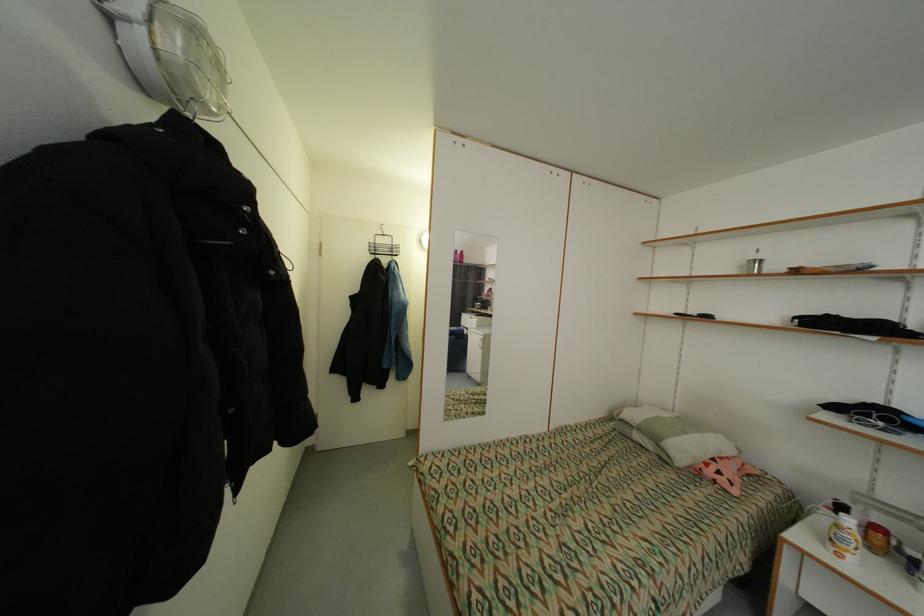
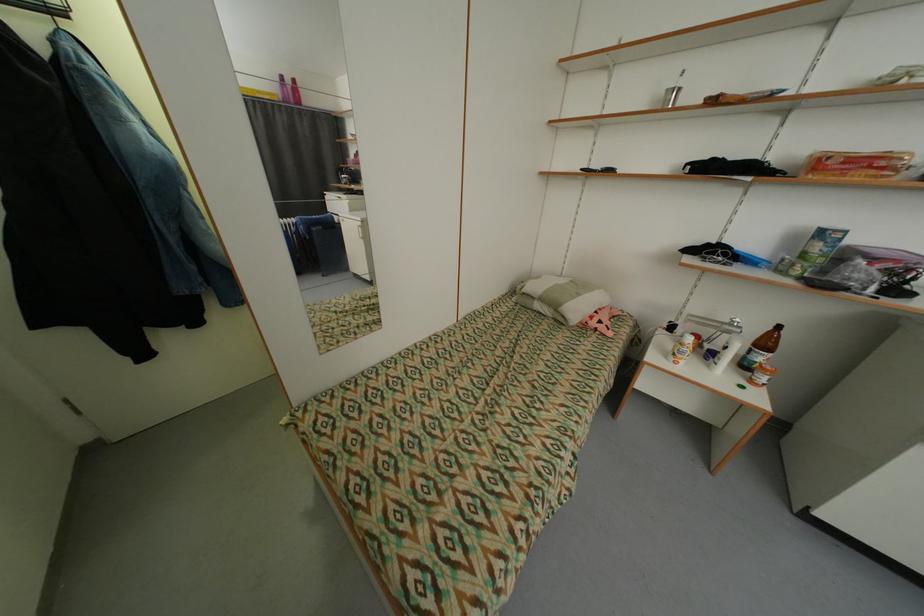
Where in the second image is the point corresponding to [715,474] from the first image?

(600, 323)